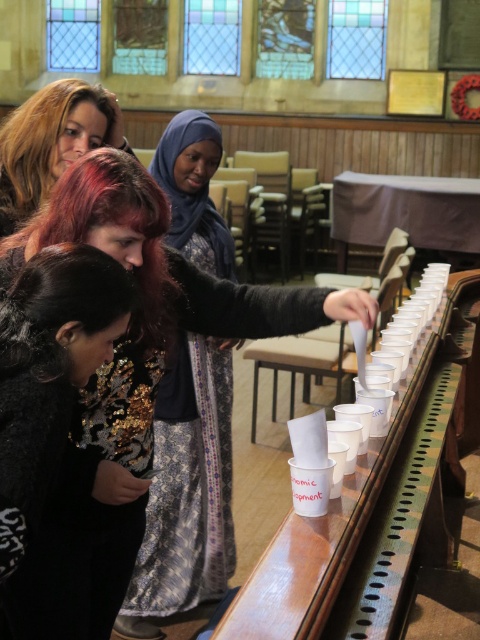
You are standing at the entrance of the room and want to greet the person with the patterned fabric dress at center and the person with matte black hair at upper left. Which person should you approach first to greet them?

You should approach the person with the patterned fabric dress at center first because they are closer to you than the matte black hair at upper left, which is further away.

You are a photographer planning to take a group photo of the two women wearing the sequined fabric dress at center and the patterned fabric dress at center. Which dress should you ask the person to wear on the side to ensure they are more visible in the photo?

The sequined fabric dress at center is bigger than the patterned fabric dress at center, so the person wearing the sequined fabric dress at center should stand on the side to be more visible.

You are a photographer at the event and want to capture both the sequined fabric dress at center and the patterned fabric dress at center in a single photo. Since you can only focus on one dress at a time, which dress should you focus on to ensure the other is still visible in the background?

You should focus on the sequined fabric dress at center because it is in front of the patterned fabric dress at center, so the patterned fabric dress at center will appear in the background.